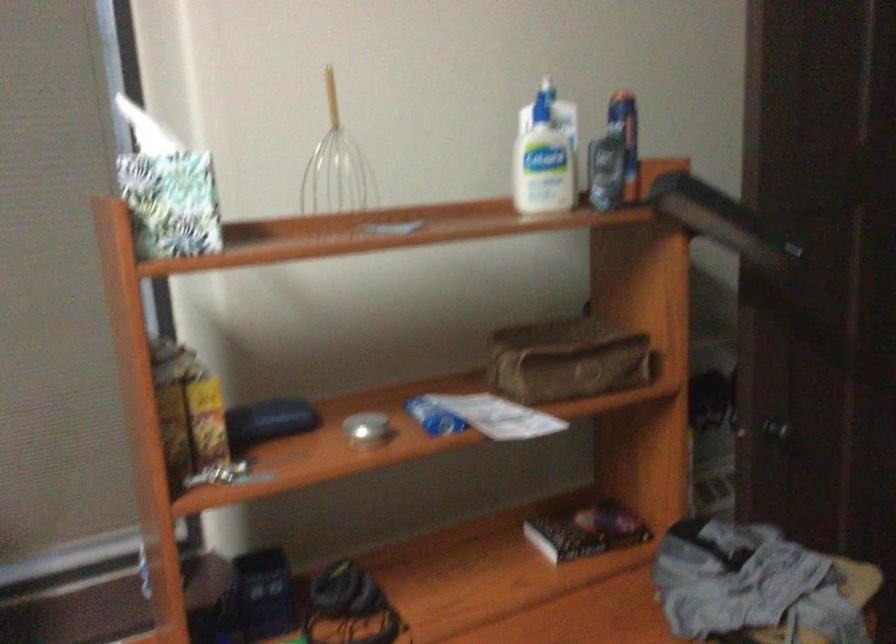
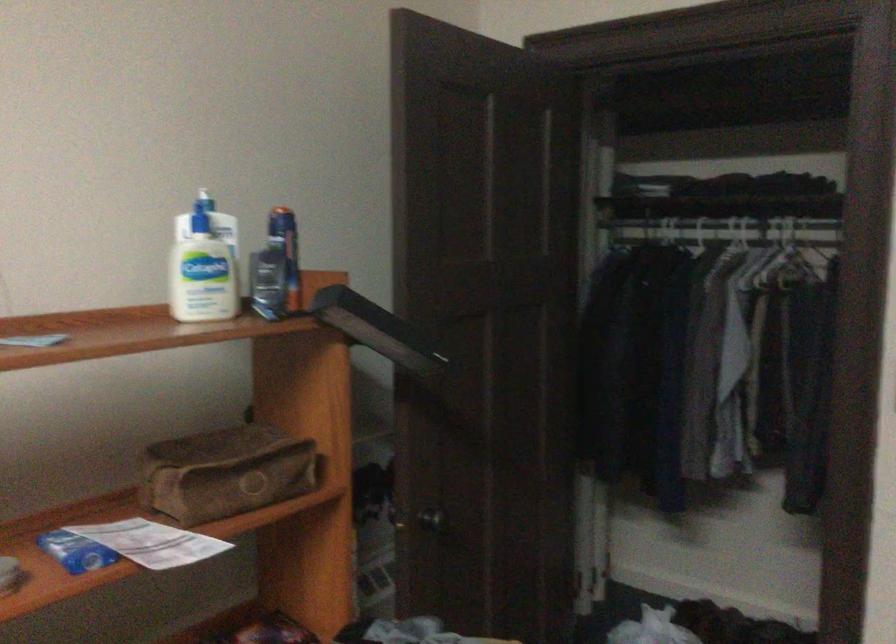
In the second image, find the point that corresponds to pixel 781 427 in the first image.

(433, 520)